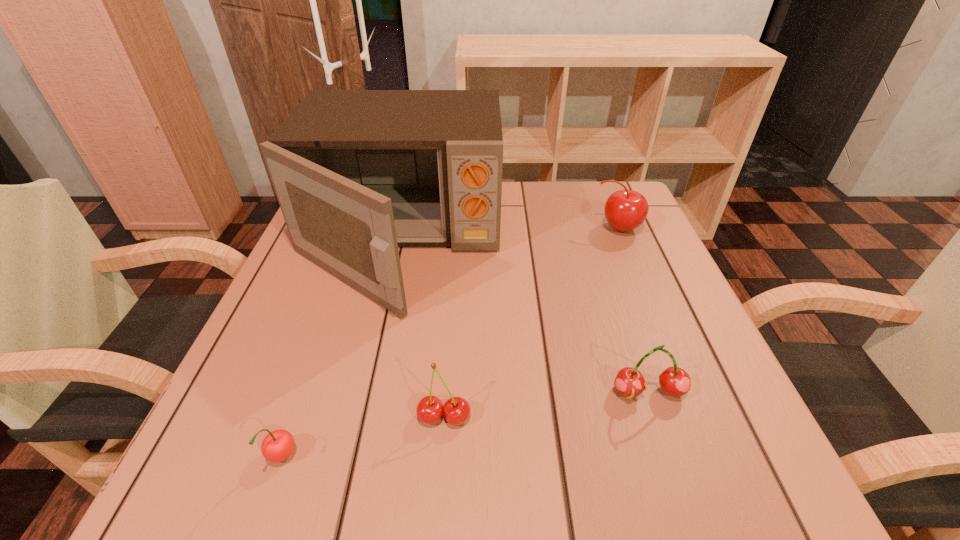
At what (x,y) coordinates should I click in order to perform the action: click on cherry at the far edge. Please return your answer as a coordinate pair (x, y). The height and width of the screenshot is (540, 960). Looking at the image, I should click on (625, 210).

Where is `object at the near edge`? The width and height of the screenshot is (960, 540). object at the near edge is located at coordinates (277, 446).

The image size is (960, 540). What are the coordinates of `microwave oven that is at the left edge` in the screenshot? It's located at (357, 173).

Locate an element on the screen. This screenshot has width=960, height=540. cherry located in the left edge section of the desktop is located at coordinates (277, 446).

Find the location of a particular element. This screenshot has height=540, width=960. object that is at the far left corner is located at coordinates (357, 173).

Locate an element on the screen. This screenshot has width=960, height=540. object present at the near left corner is located at coordinates (277, 446).

I want to click on object situated at the far right corner, so click(625, 210).

Identify the location of vacant region at the far edge of the desktop. This screenshot has height=540, width=960. (504, 210).

Find the location of a particular element. free region at the near edge of the desktop is located at coordinates (542, 443).

Identify the location of vacant space at the left edge of the desktop. The height and width of the screenshot is (540, 960). (339, 287).